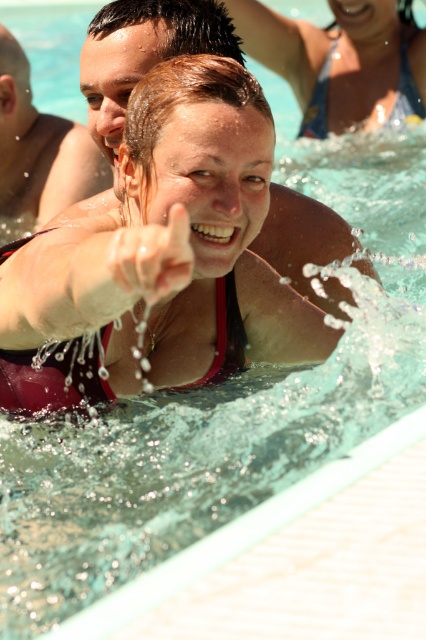
Question: Which point appears closest to the camera in this image?

Choices:
 (A) (6, 195)
 (B) (252, 3)
 (C) (173, 88)

Answer: (C)

Question: Is matte pink swimsuit at center positioned behind matte pink bikini top at upper center?

Choices:
 (A) no
 (B) yes

Answer: (A)

Question: Which point is closer to the camera?

Choices:
 (A) (2, 58)
 (B) (316, 113)
 (C) (135, 256)

Answer: (C)

Question: Is matte pink bikini top at upper center behind smooth skin face at upper center?

Choices:
 (A) yes
 (B) no

Answer: (A)

Question: Can you confirm if matte pink bikini top at upper center is smaller than smooth skin face at upper center?

Choices:
 (A) no
 (B) yes

Answer: (A)

Question: Estimate the real-world distances between objects in this image. Which object is closer to the matte pink swimsuit at center?

Choices:
 (A) matte pink bikini top at upper center
 (B) smooth skin face at upper center

Answer: (B)